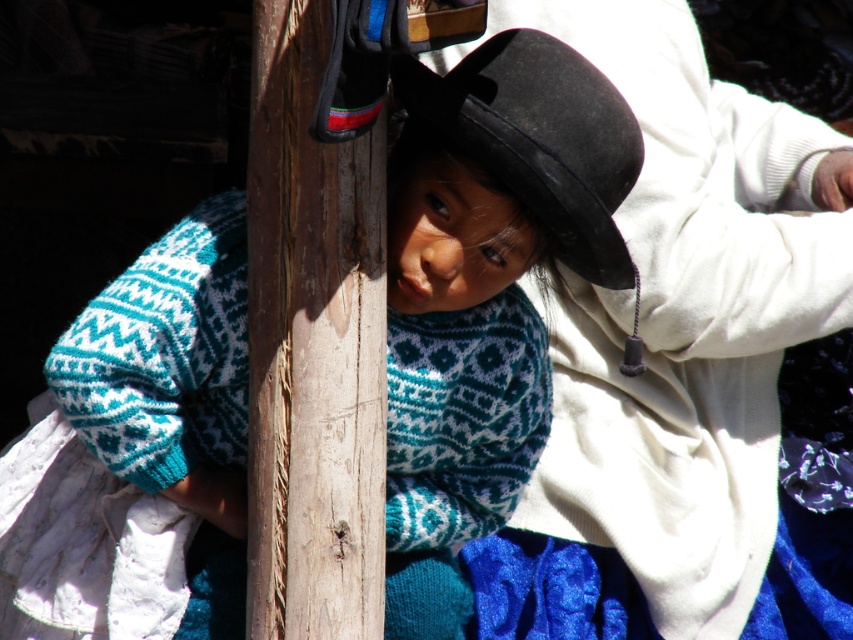
Question: Considering the real-world distances, which object is closest to the wooden pole at center?

Choices:
 (A) knitted wool sweater at center
 (B) black felt hat at center

Answer: (A)

Question: Is knitted wool sweater at center bigger than wooden pole at center?

Choices:
 (A) yes
 (B) no

Answer: (A)

Question: Which point appears farthest from the camera in this image?

Choices:
 (A) (630, 154)
 (B) (111, 426)
 (C) (360, 426)

Answer: (B)

Question: Does wooden pole at center lie behind black felt hat at center?

Choices:
 (A) no
 (B) yes

Answer: (A)

Question: Which point is farther to the camera?

Choices:
 (A) (383, 250)
 (B) (426, 214)
 (C) (496, 144)

Answer: (B)

Question: Is knitted wool sweater at center below wooden pole at center?

Choices:
 (A) yes
 (B) no

Answer: (A)